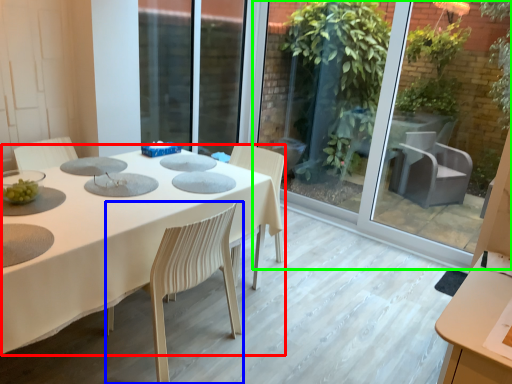
Question: Which object is the farthest from table (highlighted by a red box)? Choose among these: chair (highlighted by a blue box) or glass door (highlighted by a green box).

Choices:
 (A) chair
 (B) glass door

Answer: (B)